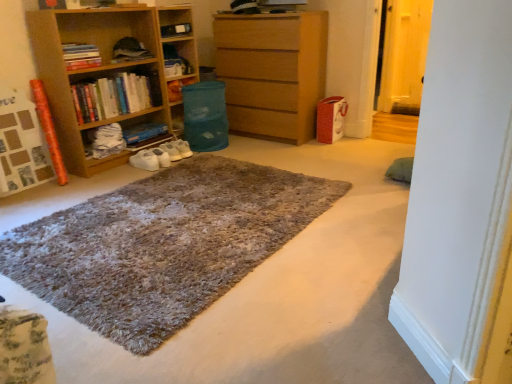
At what (x,y) coordinates should I click in order to perform the action: click on free point above matte plastic water at center, which is the first shelf in right-to-left order (from a real-world perspective). Please return your answer as a coordinate pair (x, y). Looking at the image, I should click on (177, 80).